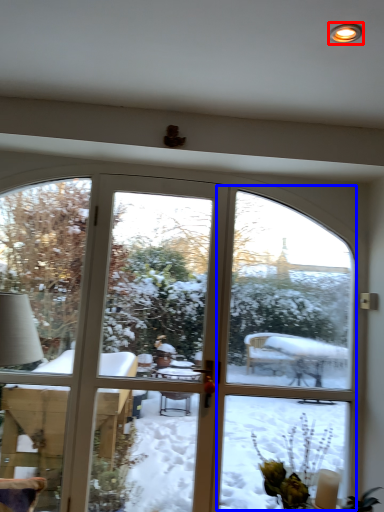
Question: Which object appears closest to the camera in this image, light (highlighted by a red box) or screen door (highlighted by a blue box)?

Choices:
 (A) light
 (B) screen door

Answer: (A)